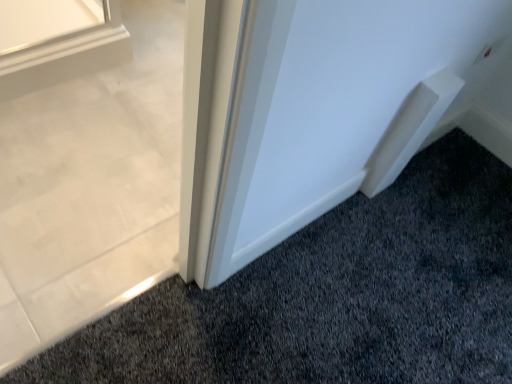
Where is `white glossy window sill at upper left`? white glossy window sill at upper left is located at coordinates (58, 41).

The width and height of the screenshot is (512, 384). Describe the element at coordinates (58, 41) in the screenshot. I see `white glossy window sill at upper left` at that location.

In order to face white glossy window sill at upper left, should I rotate leftwards or rightwards?

To align with it, rotate left about 28.121°.

The image size is (512, 384). I want to click on white glossy window sill at upper left, so click(58, 41).